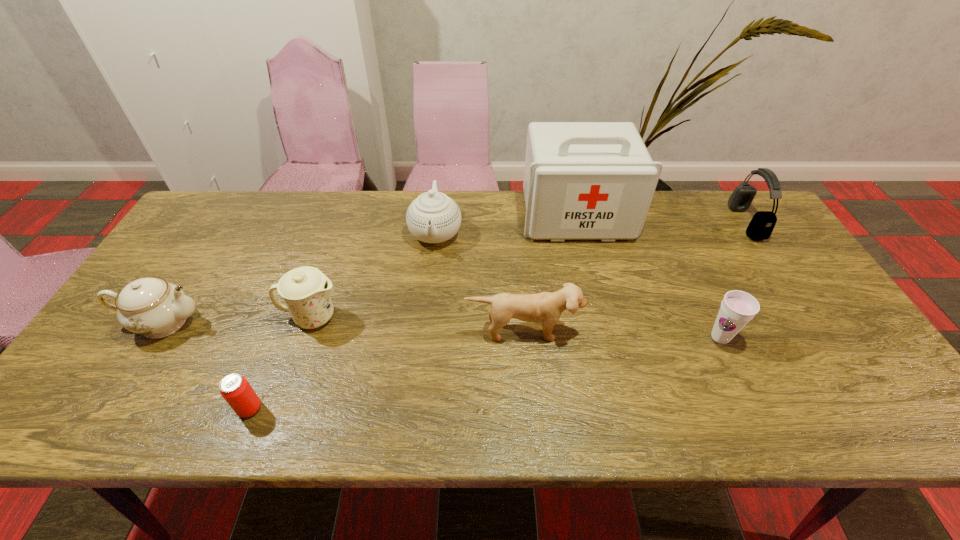
Identify the location of object identified as the fourth closest to the rightmost object. The height and width of the screenshot is (540, 960). (433, 217).

Locate an element on the screen. The height and width of the screenshot is (540, 960). object that ranks as the sixth closest to the second chinaware from left to right is located at coordinates (737, 308).

Image resolution: width=960 pixels, height=540 pixels. Identify the location of the third closest chinaware relative to the shortest object. (433, 217).

What are the coordinates of `chinaware that is the third closest to the rightmost object` in the screenshot? It's located at (152, 307).

Find the location of a particular element. Image resolution: width=960 pixels, height=540 pixels. vacant area in the image that satisfies the following two spatial constraints: 1. on the front-facing side of the first-aid kit; 2. on the left side of the cup is located at coordinates (606, 337).

At what (x,y) coordinates should I click in order to perform the action: click on blank space that satisfies the following two spatial constraints: 1. at the spout of the leftmost object; 2. on the right side of the beer can. Please return your answer as a coordinate pair (x, y). Image resolution: width=960 pixels, height=540 pixels. Looking at the image, I should click on 108,408.

Identify the location of vacant area that satisfies the following two spatial constraints: 1. on the spout of the farthest chinaware; 2. on the left side of the seventh object from left to right. This screenshot has width=960, height=540. (424, 337).

Where is `blank space that satisfies the following two spatial constraints: 1. on the front-facing side of the second object from right to left; 2. on the left side of the tallest object`? The width and height of the screenshot is (960, 540). blank space that satisfies the following two spatial constraints: 1. on the front-facing side of the second object from right to left; 2. on the left side of the tallest object is located at coordinates (606, 337).